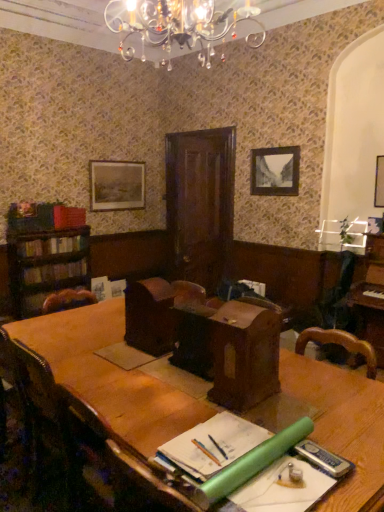
I want to click on vacant space that is to the left of brown leather armchair at center, the 2th armchair positioned from the right, so click(117, 350).